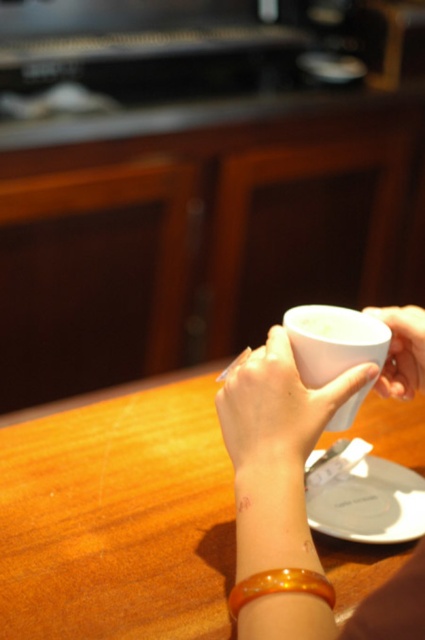
Question: Does white glossy cup at center have a smaller size compared to white glossy mug at lower center?

Choices:
 (A) yes
 (B) no

Answer: (B)

Question: Which object is positioned farthest from the white glossy mug at lower center?

Choices:
 (A) wooden table at center
 (B) white glossy cup at center
 (C) white glossy cup at right

Answer: (A)

Question: Which of these objects is positioned farthest from the white glossy mug at lower center?

Choices:
 (A) white glossy saucer at lower center
 (B) wooden table at center
 (C) orange translucent bangle at lower center

Answer: (B)

Question: Can you confirm if white glossy cup at center is thinner than orange translucent bangle at lower center?

Choices:
 (A) no
 (B) yes

Answer: (A)

Question: Is white glossy cup at right behind orange translucent bangle at lower center?

Choices:
 (A) no
 (B) yes

Answer: (B)

Question: Which object appears farthest from the camera in this image?

Choices:
 (A) wooden table at center
 (B) white glossy cup at center
 (C) white glossy cup at right

Answer: (C)